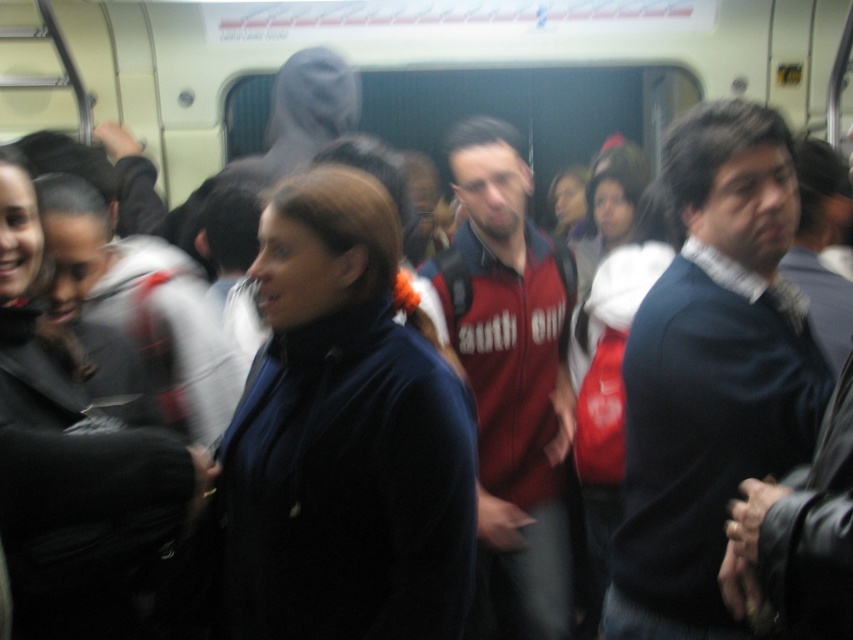
Is velvet blue jacket at center wider than dark blue sweater at center?

Indeed, velvet blue jacket at center has a greater width compared to dark blue sweater at center.

Can you confirm if velvet blue jacket at center is taller than dark blue sweater at center?

In fact, velvet blue jacket at center may be shorter than dark blue sweater at center.

Where is `velvet blue jacket at center`? velvet blue jacket at center is located at coordinates (344, 435).

At what (x,y) coordinates should I click in order to perform the action: click on velvet blue jacket at center. Please return your answer as a coordinate pair (x, y). The width and height of the screenshot is (853, 640). Looking at the image, I should click on (344, 435).

Between dark blue sweater at center and red fabric jacket at center, which one is positioned lower?

Positioned lower is red fabric jacket at center.

Does dark blue sweater at center have a greater height compared to red fabric jacket at center?

No, dark blue sweater at center is not taller than red fabric jacket at center.

Measure the distance between point (656, 500) and camera.

Point (656, 500) is 1.72 meters away from camera.

Image resolution: width=853 pixels, height=640 pixels. Find the location of `dark blue sweater at center`. dark blue sweater at center is located at coordinates click(711, 372).

Does dark blue sweater at center appear under matte black jacket at center?

No, dark blue sweater at center is not below matte black jacket at center.

Is dark blue sweater at center taller than matte black jacket at center?

Yes, dark blue sweater at center is taller than matte black jacket at center.

Locate an element on the screen. The height and width of the screenshot is (640, 853). dark blue sweater at center is located at coordinates (711, 372).